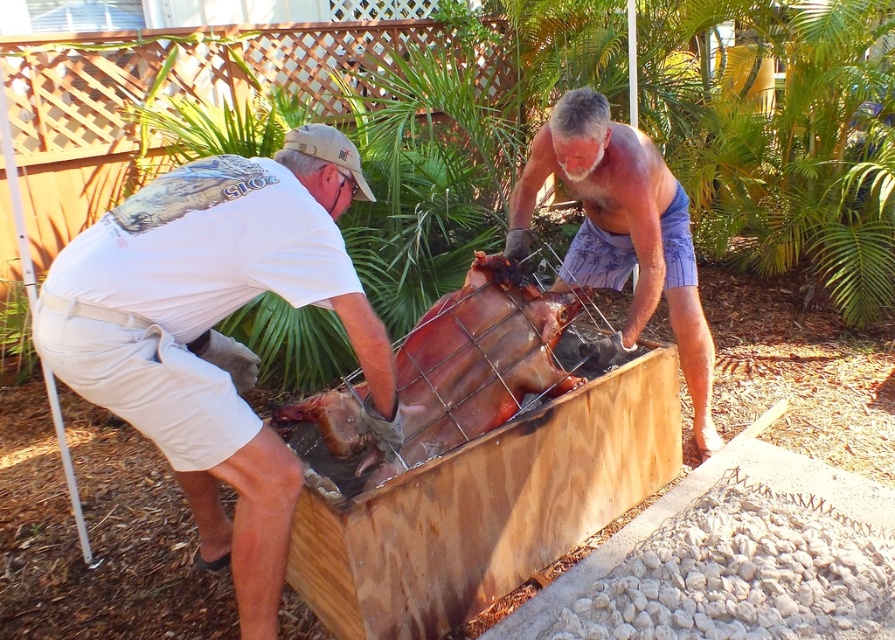
Can you confirm if white cotton shirt at left is positioned below brown leather skin at center?

Indeed, white cotton shirt at left is positioned under brown leather skin at center.

What do you see at coordinates (217, 332) in the screenshot?
I see `white cotton shirt at left` at bounding box center [217, 332].

Locate an element on the screen. This screenshot has height=640, width=895. white cotton shirt at left is located at coordinates (217, 332).

Where is `white cotton shirt at left`? The height and width of the screenshot is (640, 895). white cotton shirt at left is located at coordinates (217, 332).

Who is positioned more to the right, white cotton shirt at left or beige textured shorts at center?

Positioned to the right is beige textured shorts at center.

Can you confirm if white cotton shirt at left is positioned above beige textured shorts at center?

Actually, white cotton shirt at left is below beige textured shorts at center.

This screenshot has width=895, height=640. Describe the element at coordinates (217, 332) in the screenshot. I see `white cotton shirt at left` at that location.

Identify the location of white cotton shirt at left. This screenshot has height=640, width=895. (217, 332).

Can you confirm if beige textured shorts at center is positioned to the right of brown leather skin at center?

Yes, beige textured shorts at center is to the right of brown leather skin at center.

Is beige textured shorts at center wider than brown leather skin at center?

Incorrect, beige textured shorts at center's width does not surpass brown leather skin at center's.

At what (x,y) coordinates should I click in order to perform the action: click on beige textured shorts at center. Please return your answer as a coordinate pair (x, y). This screenshot has height=640, width=895. Looking at the image, I should click on (621, 234).

You are a GUI agent. You are given a task and a screenshot of the screen. Output one action in this format:
    pyautogui.click(x=<x>, y=<y>)
    Task: Click on the beige textured shorts at center
    
    Given the screenshot: What is the action you would take?
    pyautogui.click(x=621, y=234)